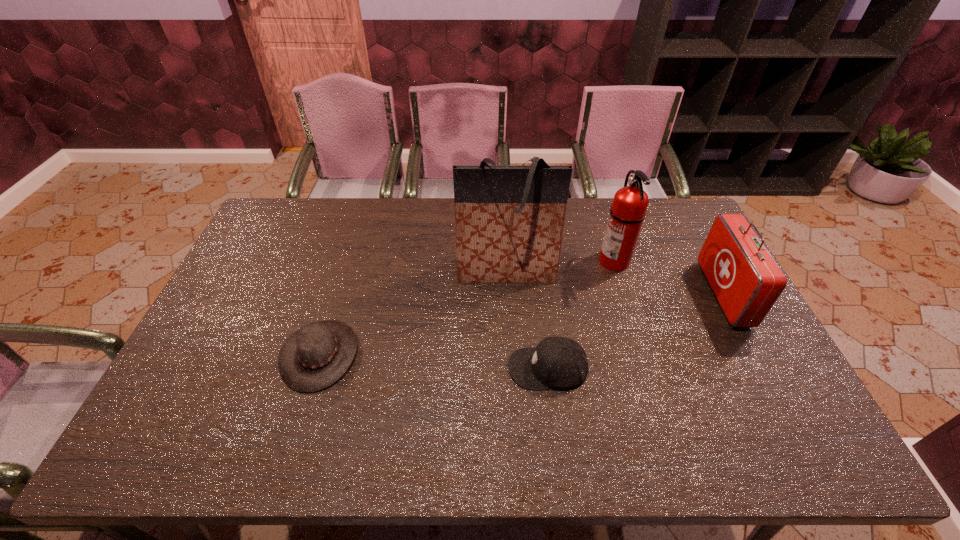
Identify the location of vacant area at the near edge. (572, 434).

This screenshot has width=960, height=540. In order to click on free space at the left edge of the desktop in this screenshot , I will do `click(272, 279)`.

Where is `free space at the right edge of the desktop`? The image size is (960, 540). free space at the right edge of the desktop is located at coordinates (767, 410).

The image size is (960, 540). I want to click on free space at the near right corner of the desktop, so click(x=782, y=434).

Locate an element on the screen. The width and height of the screenshot is (960, 540). vacant space that is in between the cap and the fourth shortest object is located at coordinates click(581, 314).

The width and height of the screenshot is (960, 540). What are the coordinates of `free space between the hat and the cap` in the screenshot? It's located at (434, 361).

You are a GUI agent. You are given a task and a screenshot of the screen. Output one action in this format:
    pyautogui.click(x=<x>, y=<y>)
    Task: Click on the empty location between the leftmost object and the cap
    Image resolution: width=960 pixels, height=540 pixels.
    Given the screenshot: What is the action you would take?
    pyautogui.click(x=434, y=361)

Image resolution: width=960 pixels, height=540 pixels. Identify the location of vacant point located between the second object from right to left and the tallest object. (561, 266).

The image size is (960, 540). I want to click on blank region between the tallest object and the fourth shortest object, so click(561, 266).

At what (x,y) coordinates should I click in order to perform the action: click on vacant space that's between the third shortest object and the cap. Please return your answer as a coordinate pair (x, y). The image size is (960, 540). Looking at the image, I should click on (636, 331).